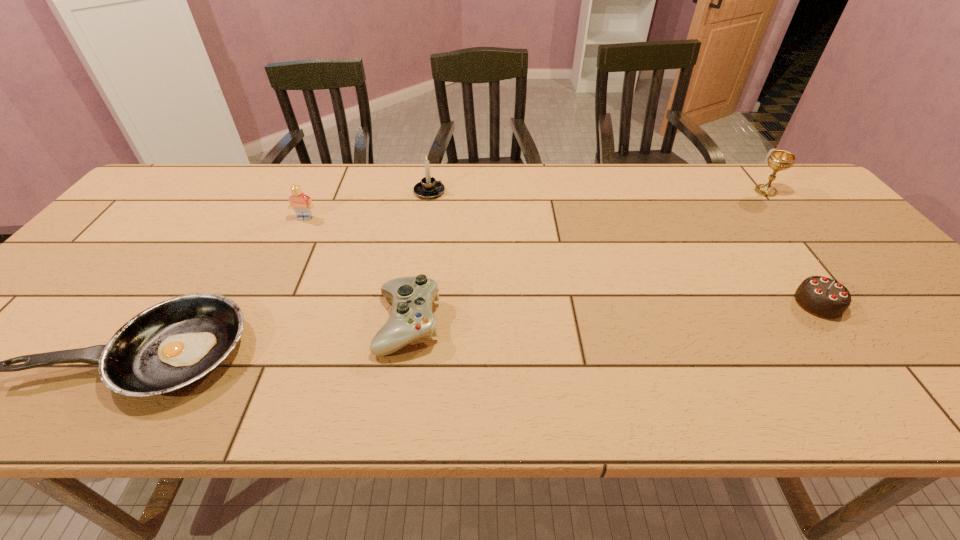
The image size is (960, 540). What are the coordinates of `candle holder present at the far edge` in the screenshot? It's located at (428, 188).

Locate an element on the screen. This screenshot has height=540, width=960. chalice located in the far edge section of the desktop is located at coordinates (779, 160).

At what (x,y) coordinates should I click in order to perform the action: click on object located at the right edge. Please return your answer as a coordinate pair (x, y). Looking at the image, I should click on (779, 160).

The height and width of the screenshot is (540, 960). In order to click on object positioned at the far right corner in this screenshot , I will do `click(779, 160)`.

Where is `free space at the far edge of the desktop`? The width and height of the screenshot is (960, 540). free space at the far edge of the desktop is located at coordinates (472, 186).

Where is `vacant space at the near edge of the desktop`? vacant space at the near edge of the desktop is located at coordinates (723, 392).

The width and height of the screenshot is (960, 540). Identify the location of free space at the left edge. (71, 305).

In the image, there is a desktop. Where is `vacant space at the right edge`? The height and width of the screenshot is (540, 960). vacant space at the right edge is located at coordinates (839, 280).

Locate an element on the screen. Image resolution: width=960 pixels, height=540 pixels. vacant space at the far left corner of the desktop is located at coordinates (180, 195).

At what (x,y) coordinates should I click in order to perform the action: click on free spot at the far right corner of the desktop. Please return your answer as a coordinate pair (x, y). Image resolution: width=960 pixels, height=540 pixels. Looking at the image, I should click on (765, 168).